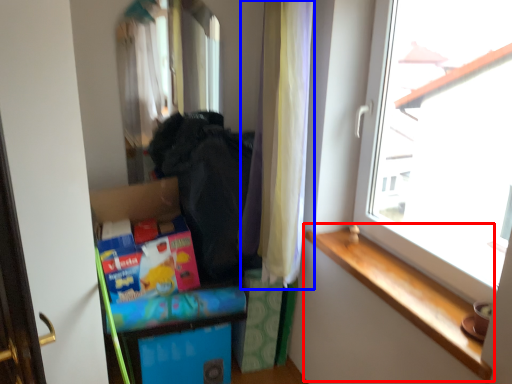
Question: Which of the following is the farthest to the observer, window sill (highlighted by a red box) or curtain (highlighted by a blue box)?

Choices:
 (A) window sill
 (B) curtain

Answer: (B)